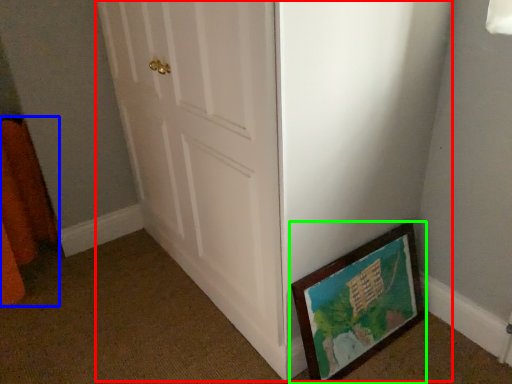
Question: Based on their relative distances, which object is farther from door (highlighted by a red box)? Choose from curtain (highlighted by a blue box) and picture frame (highlighted by a green box).

Choices:
 (A) curtain
 (B) picture frame

Answer: (A)